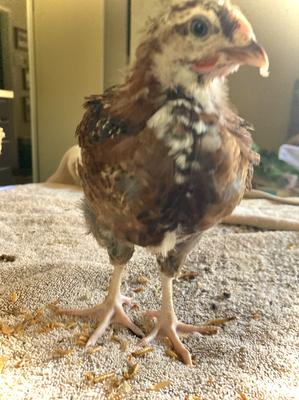
Locate an element on the screen. Image resolution: width=299 pixels, height=400 pixels. chest is located at coordinates (186, 131).